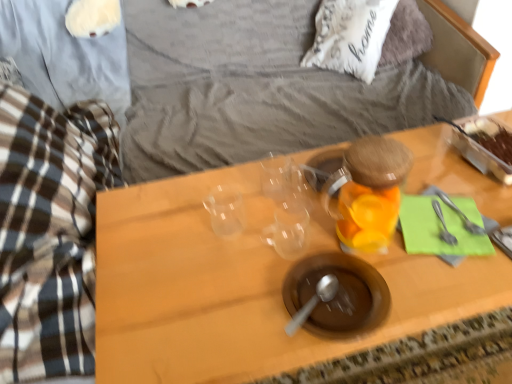
Question: Is point (384, 230) closer or farther from the camera than point (253, 192)?

Choices:
 (A) closer
 (B) farther

Answer: (A)

Question: Is transparent glass jar at center-right wider or thinner than transparent plastic cups at center?

Choices:
 (A) thin
 (B) wide

Answer: (A)

Question: Considering the real-world distances, which object is farthest from the transparent glass jar at center-right?

Choices:
 (A) transparent plastic cups at center
 (B) silver metallic fork at right, which ranks as the 1th silverware in left-to-right order
 (C) silver metallic fork at right, which is the 1th silverware from right to left
 (D) white soft pillow at upper center
 (E) brown matte bowl at center

Answer: (D)

Question: Estimate the real-world distances between objects in this image. Which object is closer to the transparent plastic cups at center?

Choices:
 (A) brown matte bowl at center
 (B) silver metallic fork at right, which is the second silverware in right-to-left order
 (C) silver metallic fork at right, the second silverware positioned from the left
 (D) white soft pillow at upper center
 (E) transparent glass jar at center-right

Answer: (A)